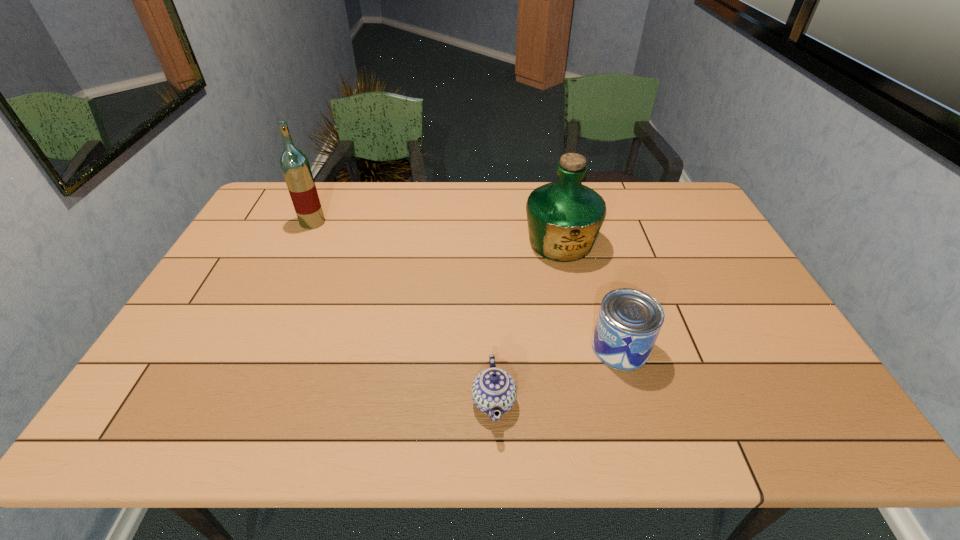
You are a GUI agent. You are given a task and a screenshot of the screen. Output one action in this format:
    pyautogui.click(x=<x>, y=<y>)
    Task: Click on the leftmost object
    This screenshot has height=540, width=960.
    Given the screenshot: What is the action you would take?
    pyautogui.click(x=295, y=166)

You are a GUI agent. You are given a task and a screenshot of the screen. Output one action in this format:
    pyautogui.click(x=<x>, y=<y>)
    Task: Click on the taller liquor
    
    Given the screenshot: What is the action you would take?
    pyautogui.click(x=295, y=166)

At what (x,y) coordinates should I click in order to perform the action: click on the third shortest object. Please return your answer as a coordinate pair (x, y). Looking at the image, I should click on (564, 218).

The width and height of the screenshot is (960, 540). Find the location of `the right liquor`. the right liquor is located at coordinates (564, 218).

The height and width of the screenshot is (540, 960). Find the location of `the third tallest object`. the third tallest object is located at coordinates (629, 321).

Find the location of a particular element. The width and height of the screenshot is (960, 540). the shortest object is located at coordinates (493, 389).

Where is `the second object from left to right`? the second object from left to right is located at coordinates (493, 389).

Locate an element on the screen. Image resolution: width=960 pixels, height=540 pixels. blank space located 0.160m on the left of the left liquor is located at coordinates (252, 222).

The image size is (960, 540). I want to click on free point located 0.210m on the label side of the right liquor, so click(577, 320).

Locate an element on the screen. This screenshot has height=540, width=960. vacant space located 0.340m on the front label of the can is located at coordinates (456, 347).